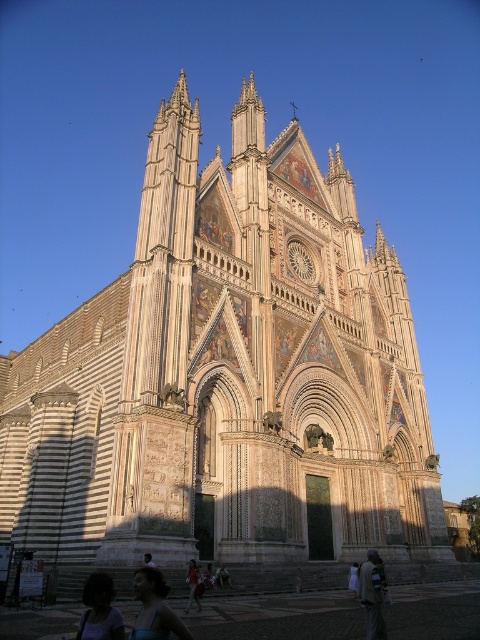
From the picture: You are standing in front of the Orvieto Cathedral and notice two points marked on its facade. The first point is at coordinates point (94, 592) and the second is at point (200, 604). Which of these two points is closer to your current position?

Point (94, 592) is closer to the camera than point (200, 604), so the first point is closer to your current position.

You are a photographer planning to capture a portrait of the two subjects wearing a light brown fabric dress at lower center and having light brown hair at lower center. To ensure both subjects are fully visible, you need to know which one is wider. Which subject has a greater width?

The light brown fabric dress at lower center has a greater width than the light brown hair at lower center.

You are standing near the Orvieto Cathedral and want to take a photo of both the matte black hair at lower center and the light brown leather jacket at lower center. Given that your camera can capture objects within a 10 meter range, will both items be in the same frame?

The distance between the matte black hair at lower center and the light brown leather jacket at lower center is 8.91 meters, which is within the 10 meter range of your camera. Therefore, both items can be captured in the same frame.